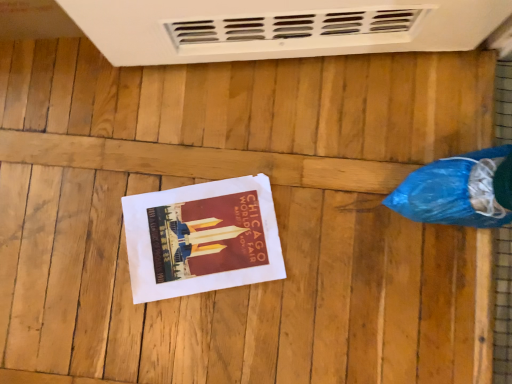
This screenshot has height=384, width=512. What do you see at coordinates (243, 28) in the screenshot?
I see `white plastic water heater at upper center` at bounding box center [243, 28].

Where is `white plastic water heater at upper center`? white plastic water heater at upper center is located at coordinates (243, 28).

This screenshot has height=384, width=512. I want to click on white plastic water heater at upper center, so click(243, 28).